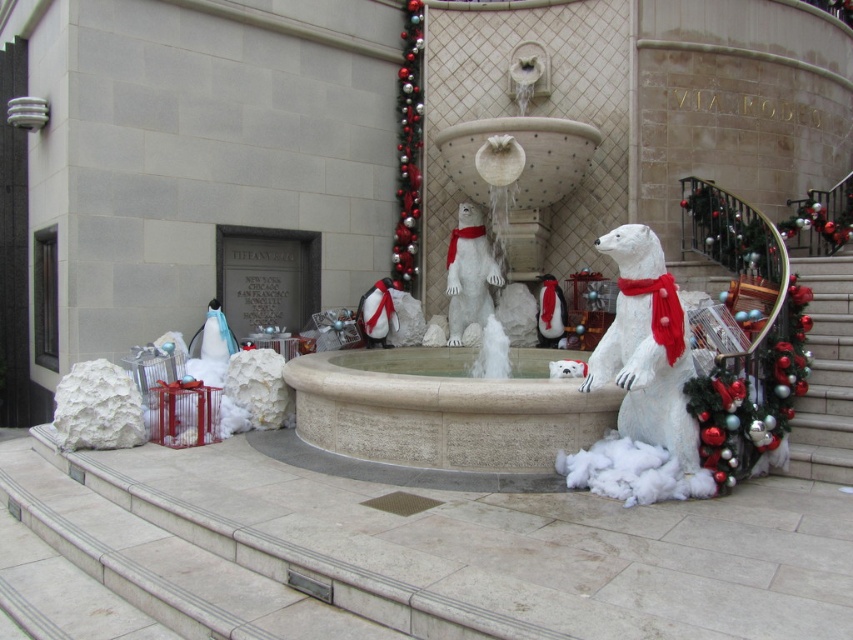
What do you see at coordinates (646, 348) in the screenshot? I see `white paper bear at center` at bounding box center [646, 348].

Between white paper bear at center and white fluffy polar bear at center, which one appears on the right side from the viewer's perspective?

white paper bear at center

Who is more distant from viewer, (613, 324) or (456, 228)?

The point (456, 228) is behind.

The height and width of the screenshot is (640, 853). I want to click on white paper bear at center, so click(646, 348).

Which is behind, point (810, 257) or point (450, 236)?

The point (450, 236) is behind.

Does smooth stone staircase at lower right come in front of white fluffy polar bear at center?

Yes, smooth stone staircase at lower right is closer to the viewer.

Between point (844, 268) and point (469, 307), which one is positioned in front?

Point (844, 268) is more forward.

Locate an element on the screen. This screenshot has height=640, width=853. smooth stone staircase at lower right is located at coordinates (825, 372).

Which is above, shiny metallic garland at center or white fluffy polar bear at center?

shiny metallic garland at center is above.

This screenshot has height=640, width=853. Describe the element at coordinates (408, 148) in the screenshot. I see `shiny metallic garland at center` at that location.

Between point (419, 157) and point (485, 244), which one is positioned behind?

The point (419, 157) is more distant.

Where is `shiny metallic garland at center`? Image resolution: width=853 pixels, height=640 pixels. shiny metallic garland at center is located at coordinates (408, 148).